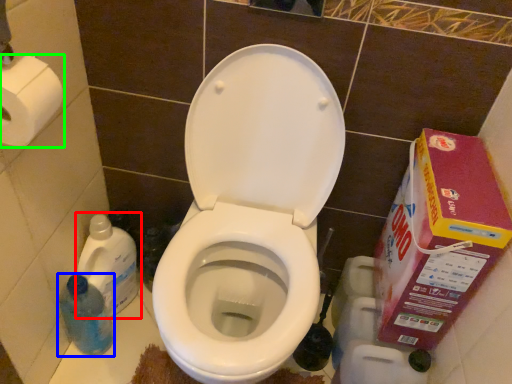
Question: Which is farther away from cleaning product (highlighted by a red box)? cleaning product (highlighted by a blue box) or toilet paper (highlighted by a green box)?

Choices:
 (A) cleaning product
 (B) toilet paper

Answer: (B)